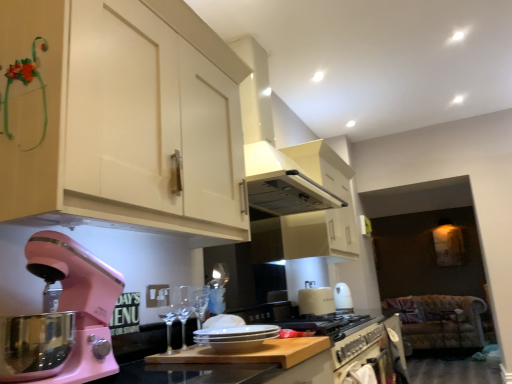
Question: Considering the relative positions of metallic silver oven at lower center and clear glass wine glass at center, which is the second wine glass in back-to-front order, in the image provided, is metallic silver oven at lower center to the left or to the right of clear glass wine glass at center, which is the second wine glass in back-to-front order,?

Choices:
 (A) left
 (B) right

Answer: (B)

Question: Is point (338, 347) positioned closer to the camera than point (170, 291)?

Choices:
 (A) farther
 (B) closer

Answer: (A)

Question: Estimate the real-world distances between objects in this image. Which object is farther from the pink matte stand mixer at lower left?

Choices:
 (A) velvet floral-patterned sofa at lower right
 (B) clear glass wine glass at center, positioned as the first wine glass in front-to-back order
 (C) clear glass wine glass at center, marked as the 1th wine glass in a back-to-front arrangement
 (D) green matte decoration at upper left, positioned as the 2th cabinetry in front-to-back order
 (E) smooth wooden cutting board at center

Answer: (A)

Question: Based on their relative distances, which object is farther from the clear glass wine glass at center, which is the second wine glass in back-to-front order?

Choices:
 (A) velvet floral-patterned sofa at lower right
 (B) white glossy exhaust hood at upper center
 (C) green matte decoration at upper left, marked as the first cabinetry in a back-to-front arrangement
 (D) metallic silver oven at lower center
 (E) white matte cabinet at upper center, marked as the first cabinetry in a front-to-back arrangement

Answer: (A)